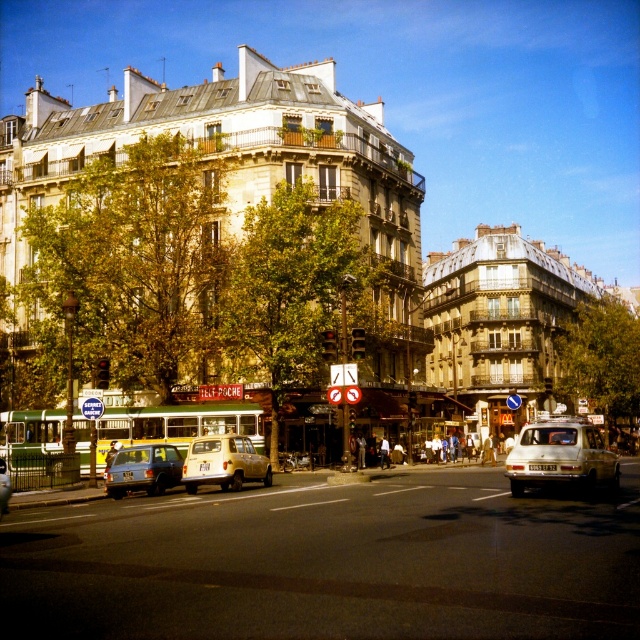
Question: Does green matte bus at center appear on the right side of matte yellow car at center?

Choices:
 (A) no
 (B) yes

Answer: (B)

Question: Which point is closer to the camera?

Choices:
 (A) light beige matte suv at center
 (B) metallic silver car at lower left
 (C) matte yellow car at center

Answer: (C)

Question: Which point is closer to the camera?

Choices:
 (A) (220, 451)
 (B) (506, 476)
 (C) (81, 422)
 (D) (148, 492)

Answer: (A)

Question: Can you confirm if green matte bus at center is positioned above light beige matte suv at center?

Choices:
 (A) yes
 (B) no

Answer: (A)

Question: Can you confirm if green matte bus at center is bigger than metallic silver car at lower left?

Choices:
 (A) no
 (B) yes

Answer: (B)

Question: Which object appears farthest from the camera in this image?

Choices:
 (A) matte yellow car at center
 (B) metallic silver car at lower left
 (C) green matte bus at center

Answer: (C)